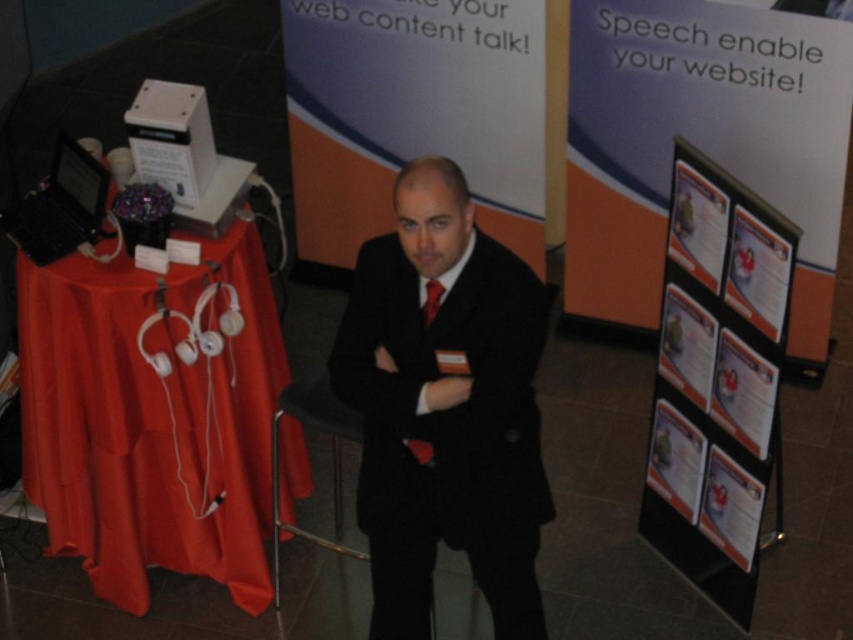
Consider the image. You are a photographer at the event and need to adjust the lighting so that both the red silk tie at center and the shiny red tie at center are well lit. Since you can only focus the light on one tie at a time, which tie should you light first to ensure the other is also adequately lit?

The red silk tie at center is to the right of shiny red tie at center. Since the photographer can only focus on one tie at a time, they should light the shiny red tie at center first because it is positioned to the left of the red silk tie at center, allowing the light to naturally spread towards the right as well.

You are a photographer setting up for an event. You need to position a large camera on a stand so that it can capture both the orange fabric table at left and the black matte suit at center clearly. Given the height difference between them, which object will require the camera to be adjusted higher to focus on it?

The black matte suit at center is taller than the orange fabric table at left, so the camera will need to be adjusted higher to focus on the black matte suit at center.